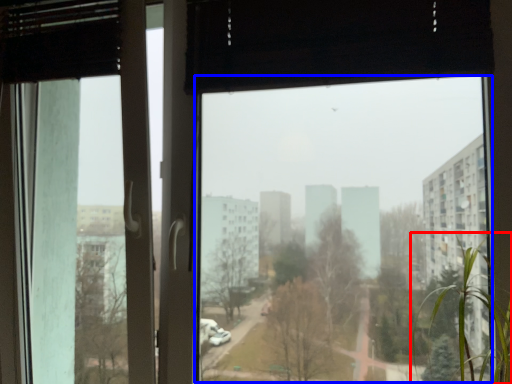
Question: Among these objects, which one is nearest to the camera, tree (highlighted by a red box) or window screen (highlighted by a blue box)?

Choices:
 (A) tree
 (B) window screen

Answer: (A)